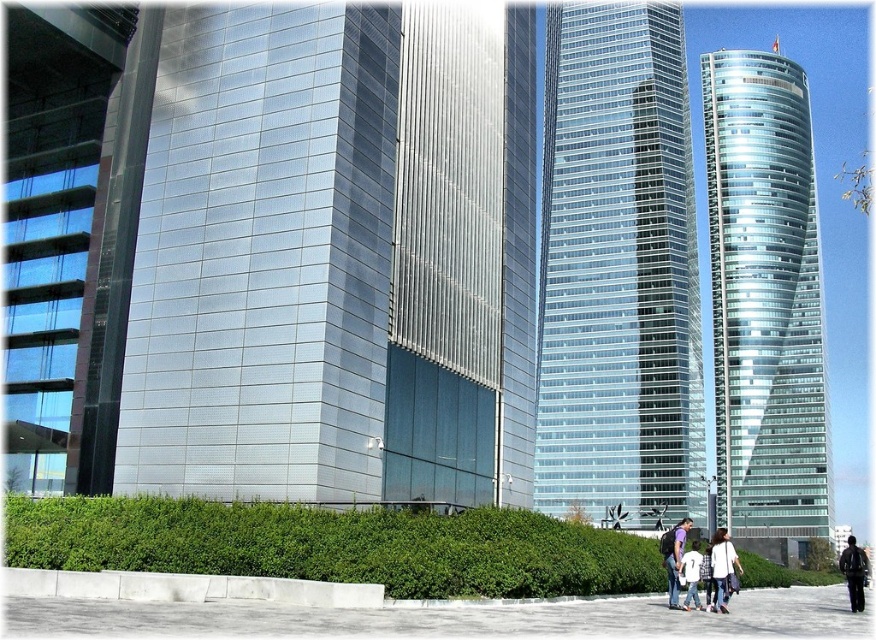
Question: Is white matte shirt at center smaller than dark blue jeans at lower right?

Choices:
 (A) no
 (B) yes

Answer: (B)

Question: Estimate the real-world distances between objects in this image. Which object is farther from the dark blue jeans at lower right?

Choices:
 (A) glassy steel skyscraper at center
 (B) gray concrete pavement at lower center
 (C) shiny glass tower at right

Answer: (A)

Question: Is dark blue jeans at lower right closer to camera compared to white cotton shirt at center?

Choices:
 (A) no
 (B) yes

Answer: (A)

Question: Is gray concrete pavement at lower center to the left of dark blue jeans at lower right from the viewer's perspective?

Choices:
 (A) no
 (B) yes

Answer: (B)

Question: Which object appears farthest from the camera in this image?

Choices:
 (A) white cotton shirt at center
 (B) green leafy hedge at lower center

Answer: (A)

Question: Which object is the farthest from the green leafy hedge at lower center?

Choices:
 (A) glassy steel skyscraper at center
 (B) white matte shirt at center

Answer: (A)